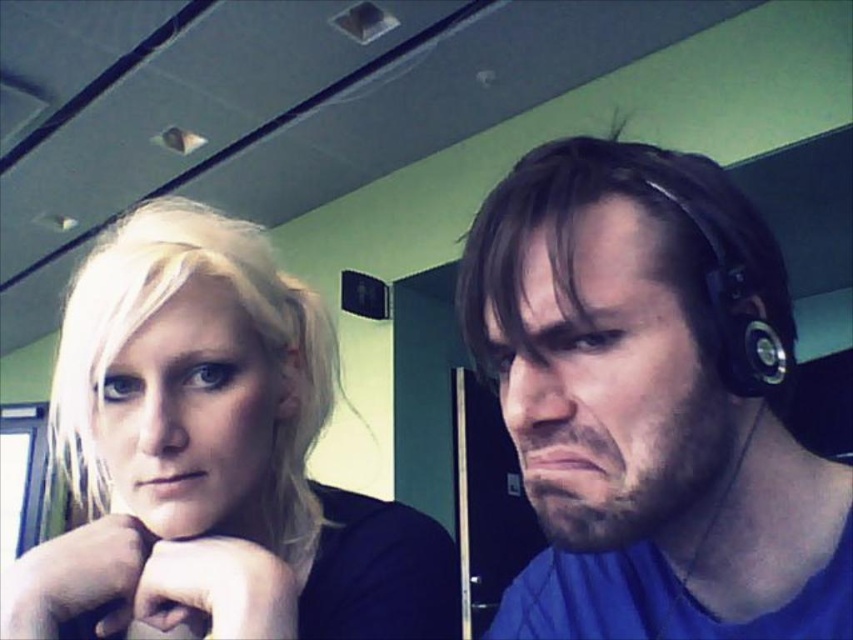
Does blonde hair at left have a smaller size compared to black rubber earphone at right?

No.

Does point (250, 452) come farther from viewer compared to point (753, 385)?

Yes, it is.

Which is behind, point (276, 444) or point (781, 349)?

The point (276, 444) is behind.

Where is `blonde hair at left`? The height and width of the screenshot is (640, 853). blonde hair at left is located at coordinates (212, 458).

Does matte black headphones at right appear over black rubber earphone at right?

No.

Does matte black headphones at right have a lesser width compared to black rubber earphone at right?

No, matte black headphones at right is not thinner than black rubber earphone at right.

Locate an element on the screen. matte black headphones at right is located at coordinates (647, 403).

Does matte black headphones at right have a smaller size compared to blonde hair at left?

Yes.

Is matte black headphones at right behind blonde hair at left?

No, matte black headphones at right is closer to the viewer.

Identify the location of matte black headphones at right. The image size is (853, 640). (647, 403).